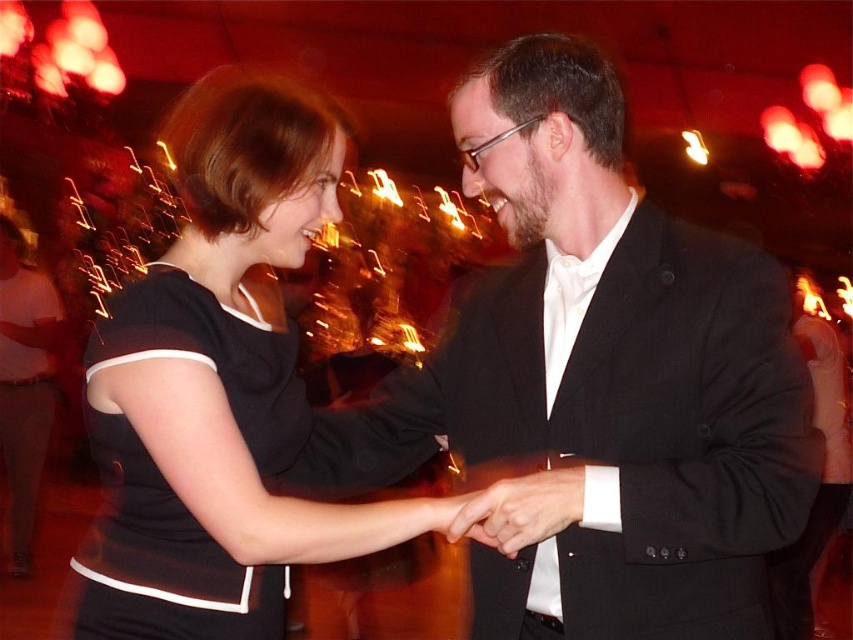
Question: Does black matte dress at center appear on the left side of black jersey dress at left?

Choices:
 (A) no
 (B) yes

Answer: (A)

Question: Is black matte dress at center wider than black jersey dress at left?

Choices:
 (A) no
 (B) yes

Answer: (B)

Question: Which point is closer to the camera?

Choices:
 (A) black suit at center
 (B) matte black hand at center
 (C) black matte dress at center
 (D) black jersey dress at left

Answer: (C)

Question: Is black matte dress at center further to camera compared to matte black hand at center?

Choices:
 (A) no
 (B) yes

Answer: (A)

Question: Which object is farther from the camera taking this photo?

Choices:
 (A) black jersey dress at left
 (B) black suit at center
 (C) black matte dress at center

Answer: (A)

Question: Among these points, which one is farthest from the camera?

Choices:
 (A) (515, 545)
 (B) (158, 340)
 (C) (595, 177)
 (D) (195, 376)

Answer: (C)